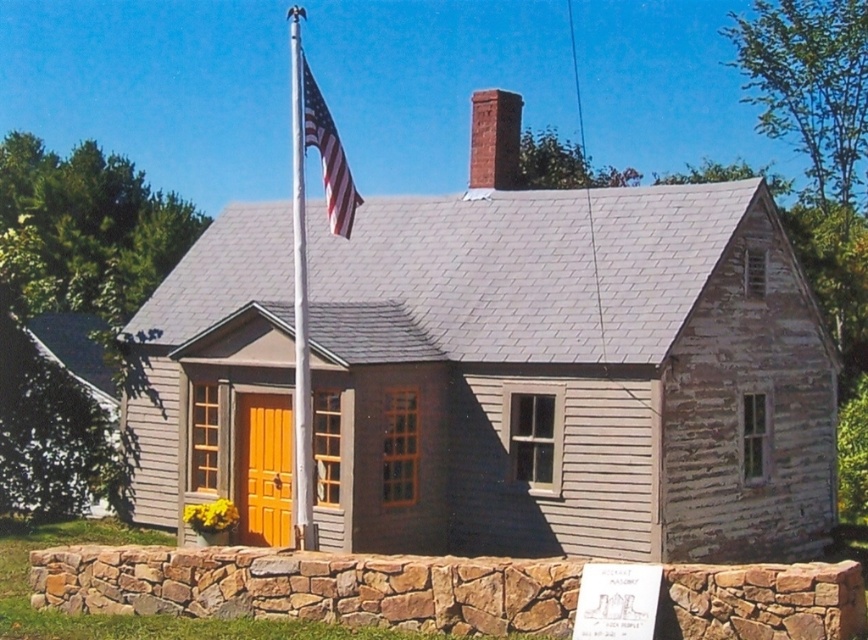
Can you confirm if silver metallic flag pole at center is thinner than american flag at center?

Yes, silver metallic flag pole at center is thinner than american flag at center.

Is point (297, 220) positioned behind point (332, 202)?

No, (297, 220) is closer to viewer.

The width and height of the screenshot is (868, 640). Find the location of `silver metallic flag pole at center`. silver metallic flag pole at center is located at coordinates (300, 301).

Does silver metallic flag pole at center appear under red brick chimney at upper center?

Yes, silver metallic flag pole at center is below red brick chimney at upper center.

Is silver metallic flag pole at center to the right of red brick chimney at upper center from the viewer's perspective?

No, silver metallic flag pole at center is not to the right of red brick chimney at upper center.

Where is `silver metallic flag pole at center`? silver metallic flag pole at center is located at coordinates (300, 301).

Consider the image. Can you confirm if wooden door at center is positioned above silver metallic flag pole at center?

Incorrect, wooden door at center is not positioned above silver metallic flag pole at center.

Image resolution: width=868 pixels, height=640 pixels. What are the coordinates of `wooden door at center` in the screenshot? It's located at (264, 468).

The width and height of the screenshot is (868, 640). What are the coordinates of `wooden door at center` in the screenshot? It's located at (264, 468).